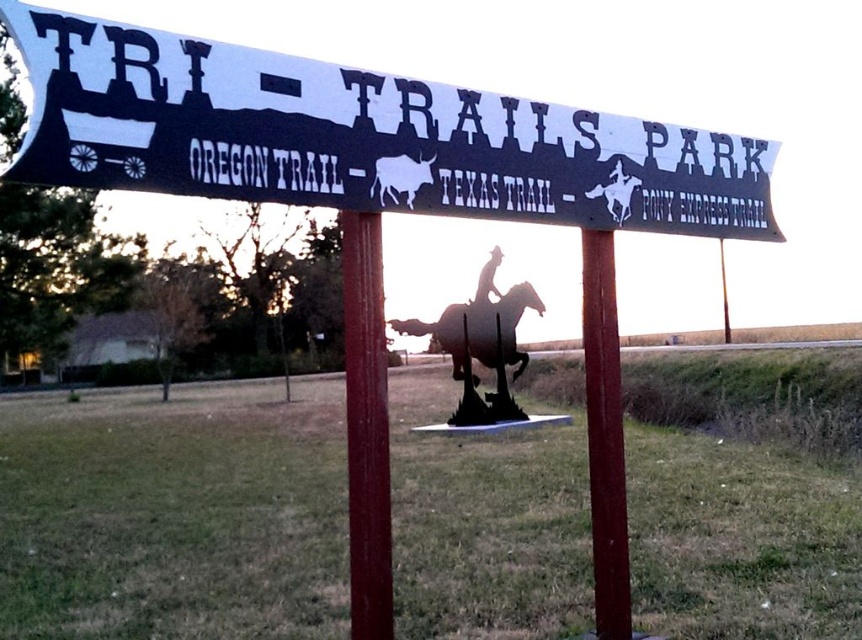
Does red painted wood post at center appear on the left side of red painted metal pole at center?

Indeed, red painted wood post at center is positioned on the left side of red painted metal pole at center.

Identify the location of red painted wood post at center. The width and height of the screenshot is (862, 640). (366, 428).

Does point (379, 339) come farther from viewer compared to point (586, 353)?

No, (379, 339) is closer to viewer.

You are a GUI agent. You are given a task and a screenshot of the screen. Output one action in this format:
    pyautogui.click(x=<x>, y=<y>)
    Task: Click on the red painted wood post at center
    
    Given the screenshot: What is the action you would take?
    pyautogui.click(x=366, y=428)

How far apart are red painted wood post at center and metallic gold cowboy at center?

They are 10.71 meters apart.

Is the position of red painted wood post at center more distant than that of metallic gold cowboy at center?

No.

Who is more forward, (386,605) or (490,253)?

Point (386,605) is in front.

Locate an element on the screen. This screenshot has height=640, width=862. red painted wood post at center is located at coordinates (366, 428).

Looking at this image, which is below, black metal sign at upper center or metallic gold cowboy at center?

black metal sign at upper center is lower down.

Can you confirm if black metal sign at upper center is positioned below metallic gold cowboy at center?

Yes.

Does point (25, 19) lie behind point (479, 298)?

No.

Locate an element on the screen. The height and width of the screenshot is (640, 862). black metal sign at upper center is located at coordinates (360, 138).